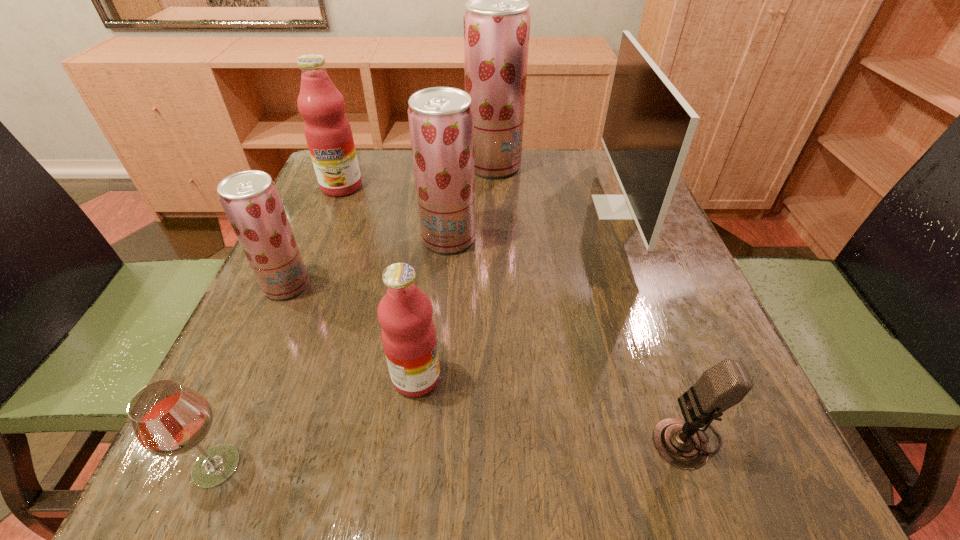
Locate an element on the screen. The height and width of the screenshot is (540, 960). vacant area that lies between the microphone and the tallest object is located at coordinates (589, 301).

Locate an element on the screen. This screenshot has width=960, height=540. free space between the second biggest strawberry fruit juice and the microphone is located at coordinates (567, 338).

Locate an element on the screen. The width and height of the screenshot is (960, 540). free space that is in between the nearest strawberry fruit juice and the left pink fruit juice is located at coordinates (314, 236).

Find the location of `empty space between the black monitor and the third nearest object`. empty space between the black monitor and the third nearest object is located at coordinates (516, 292).

Identify the location of free spot between the microphone and the smallest strawberry fruit juice. (486, 361).

The height and width of the screenshot is (540, 960). I want to click on free spot between the monitor and the farthest strawberry fruit juice, so click(x=556, y=186).

Where is `free spot between the wineglass and the farther pink fruit juice`? free spot between the wineglass and the farther pink fruit juice is located at coordinates 278,326.

Locate an element on the screen. Image resolution: width=960 pixels, height=540 pixels. free space between the third farthest fruit juice and the microphone is located at coordinates (567, 338).

Locate which object ranks fourth in proximity to the microphone. Please provide its 2D coordinates. Your answer should be formatted as a tuple, i.e. [(x, y)], where the tuple contains the x and y coordinates of a point satisfying the conditions above.

[(169, 419)]

This screenshot has width=960, height=540. I want to click on object that is the second closest one to the wineglass, so click(x=250, y=199).